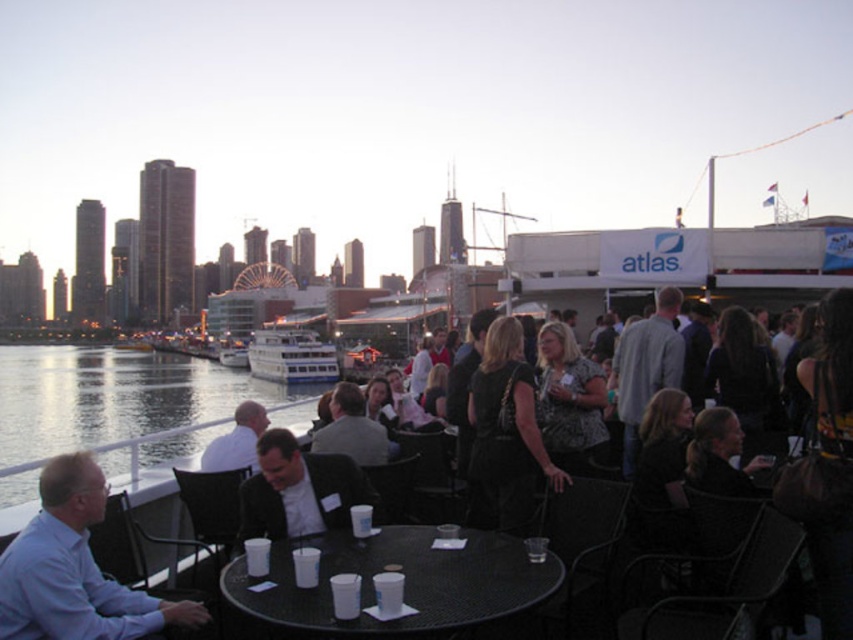
Question: Which object is closer to the camera taking this photo?

Choices:
 (A) black leather dress at center
 (B) reflective glass water at lower left
 (C) white plastic table at center

Answer: (C)

Question: Does white shirt at lower left have a lesser width compared to black leather dress at center?

Choices:
 (A) no
 (B) yes

Answer: (A)

Question: Based on their relative distances, which object is farther from the light gray suit at center?

Choices:
 (A) white plastic table at center
 (B) reflective glass water at lower left

Answer: (B)

Question: Which point is farther from the camera taking this photo?

Choices:
 (A) (62, 493)
 (B) (270, 369)

Answer: (B)

Question: Does white shirt at lower left appear under dark suit at center?

Choices:
 (A) no
 (B) yes

Answer: (B)

Question: Does black leather dress at center lie behind white glossy cruise ship at center?

Choices:
 (A) yes
 (B) no

Answer: (B)